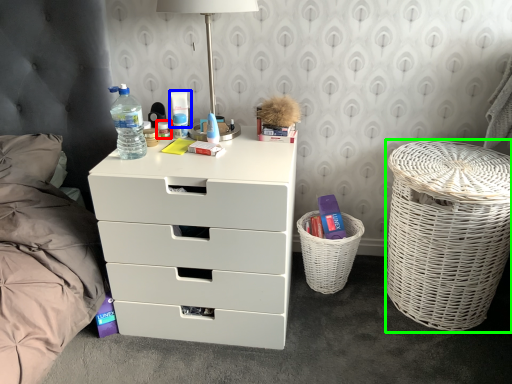
Question: Which is nearer to the toiletry (highlighted by a red box)? toiletry (highlighted by a blue box) or laundry basket (highlighted by a green box).

Choices:
 (A) toiletry
 (B) laundry basket

Answer: (A)